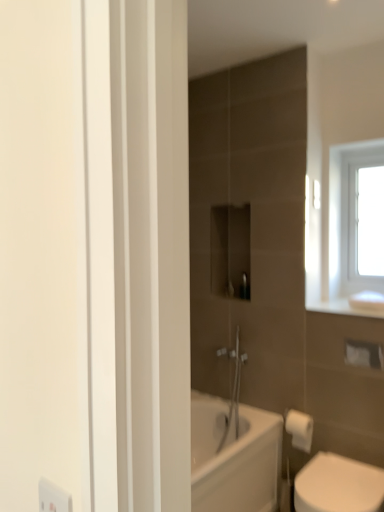
Question: Considering the relative positions of white matte toilet paper at lower right and white glass window at upper right in the image provided, is white matte toilet paper at lower right to the left or to the right of white glass window at upper right?

Choices:
 (A) left
 (B) right

Answer: (A)

Question: Is white matte toilet paper at lower right taller or shorter than white glass window at upper right?

Choices:
 (A) tall
 (B) short

Answer: (B)

Question: Considering the real-world distances, which object is closest to the white glass window at upper right?

Choices:
 (A) white matte toilet paper at lower right
 (B) white glossy toilet at lower right

Answer: (A)

Question: Which object is the closest to the white glossy toilet at lower right?

Choices:
 (A) white matte toilet paper at lower right
 (B) white glass window at upper right

Answer: (A)